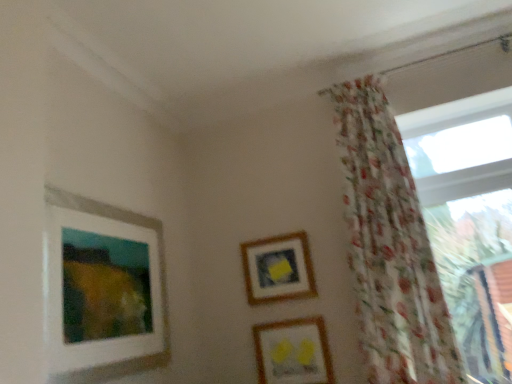
What is the approximate width of white matte picture frame at upper left, the first picture frame when ordered from left to right?

It is 2.70 inches.

How much space does matte yellow birds at lower center, which ranks as the first picture frame in right-to-left order, occupy horizontally?

It is 3.52 centimeters.

Identify the location of wooden frame at center, marked as the 2th picture frame in a left-to-right arrangement. The width and height of the screenshot is (512, 384). (278, 269).

Would you say matte yellow birds at lower center, which ranks as the first picture frame in right-to-left order, is outside transparent glass window at right?

Absolutely, matte yellow birds at lower center, which ranks as the first picture frame in right-to-left order, is external to transparent glass window at right.

Between matte yellow birds at lower center, which ranks as the first picture frame in right-to-left order, and transparent glass window at right, which one has less height?

matte yellow birds at lower center, which ranks as the first picture frame in right-to-left order.

Is matte yellow birds at lower center, which ranks as the first picture frame in right-to-left order, facing towards transparent glass window at right?

No.

From a real-world perspective, who is located lower, matte yellow birds at lower center, which ranks as the first picture frame in right-to-left order, or transparent glass window at right?

matte yellow birds at lower center, which ranks as the first picture frame in right-to-left order.

Is point (281, 367) closer or farther from the camera than point (367, 260)?

Point (281, 367) is positioned farther from the camera compared to point (367, 260).

Is matte yellow birds at lower center, arranged as the third picture frame when viewed from the left, spatially inside floral sheer curtain at right, or outside of it?

matte yellow birds at lower center, arranged as the third picture frame when viewed from the left, is outside floral sheer curtain at right.

Looking at this image, is matte yellow birds at lower center, arranged as the third picture frame when viewed from the left, with floral sheer curtain at right?

No, matte yellow birds at lower center, arranged as the third picture frame when viewed from the left, is not next to floral sheer curtain at right.

Where is `picture frame above the white matte picture frame at upper left, which is the 3th picture frame from right to left (from a real-world perspective)`? The height and width of the screenshot is (384, 512). picture frame above the white matte picture frame at upper left, which is the 3th picture frame from right to left (from a real-world perspective) is located at coordinates (278, 269).

In the scene shown: From the image's perspective, is white matte picture frame at upper left, which is the 3th picture frame from right to left, above or below wooden frame at center, marked as the 2th picture frame in a left-to-right arrangement?

white matte picture frame at upper left, which is the 3th picture frame from right to left, is situated higher than wooden frame at center, marked as the 2th picture frame in a left-to-right arrangement, in the image.

Consider the image. Is white matte picture frame at upper left, the first picture frame when ordered from left to right, wider or thinner than wooden frame at center, positioned as the second picture frame in right-to-left order?

white matte picture frame at upper left, the first picture frame when ordered from left to right, is wider than wooden frame at center, positioned as the second picture frame in right-to-left order.

Is white matte picture frame at upper left, the first picture frame when ordered from left to right, to the left or to the right of wooden frame at center, positioned as the second picture frame in right-to-left order, in the image?

Clearly, white matte picture frame at upper left, the first picture frame when ordered from left to right, is on the left of wooden frame at center, positioned as the second picture frame in right-to-left order, in the image.

Is transparent glass window at right inside or outside of floral sheer curtain at right?

transparent glass window at right is located beyond the bounds of floral sheer curtain at right.

Which of these two, transparent glass window at right or floral sheer curtain at right, is wider?

floral sheer curtain at right is wider.

Are transparent glass window at right and floral sheer curtain at right beside each other?

transparent glass window at right and floral sheer curtain at right are not in contact.

Is point (489, 286) farther from viewer compared to point (345, 216)?

No, (489, 286) is in front of (345, 216).

Considering the relative positions of transparent glass window at right and matte yellow birds at lower center, which ranks as the first picture frame in right-to-left order, in the image provided, is transparent glass window at right to the right of matte yellow birds at lower center, which ranks as the first picture frame in right-to-left order, from the viewer's perspective?

Yes, transparent glass window at right is to the right of matte yellow birds at lower center, which ranks as the first picture frame in right-to-left order.

Is transparent glass window at right surrounding matte yellow birds at lower center, arranged as the third picture frame when viewed from the left?

Definitely not — matte yellow birds at lower center, arranged as the third picture frame when viewed from the left, is not inside transparent glass window at right.

Looking at this image, is transparent glass window at right directly adjacent to matte yellow birds at lower center, arranged as the third picture frame when viewed from the left?

There is a gap between transparent glass window at right and matte yellow birds at lower center, arranged as the third picture frame when viewed from the left.

What's the angular difference between transparent glass window at right and matte yellow birds at lower center, arranged as the third picture frame when viewed from the left,'s facing directions?

The facing directions of transparent glass window at right and matte yellow birds at lower center, arranged as the third picture frame when viewed from the left, are 0.234 degrees apart.

Looking at this image, does wooden frame at center, positioned as the second picture frame in right-to-left order, have a lesser height compared to matte yellow birds at lower center, which ranks as the first picture frame in right-to-left order?

No.

Who is more distant, wooden frame at center, positioned as the second picture frame in right-to-left order, or matte yellow birds at lower center, arranged as the third picture frame when viewed from the left?

wooden frame at center, positioned as the second picture frame in right-to-left order, is behind.

From a real-world perspective, who is located lower, wooden frame at center, positioned as the second picture frame in right-to-left order, or matte yellow birds at lower center, arranged as the third picture frame when viewed from the left?

matte yellow birds at lower center, arranged as the third picture frame when viewed from the left.

Could matte yellow birds at lower center, arranged as the third picture frame when viewed from the left, be considered to be inside wooden frame at center, marked as the 2th picture frame in a left-to-right arrangement?

That's incorrect, matte yellow birds at lower center, arranged as the third picture frame when viewed from the left, is not inside wooden frame at center, marked as the 2th picture frame in a left-to-right arrangement.

Considering their positions, is matte yellow birds at lower center, which ranks as the first picture frame in right-to-left order, located in front of or behind white matte picture frame at upper left, which is the 3th picture frame from right to left?

Clearly, matte yellow birds at lower center, which ranks as the first picture frame in right-to-left order, is behind white matte picture frame at upper left, which is the 3th picture frame from right to left.

How much distance is there between matte yellow birds at lower center, which ranks as the first picture frame in right-to-left order, and white matte picture frame at upper left, the first picture frame when ordered from left to right?

matte yellow birds at lower center, which ranks as the first picture frame in right-to-left order, is 32.79 inches away from white matte picture frame at upper left, the first picture frame when ordered from left to right.

Identify the location of picture frame located underneath the white matte picture frame at upper left, which is the 3th picture frame from right to left (from a real-world perspective). (293, 352).

What are the coordinates of `window on the right of matte yellow birds at lower center, which ranks as the first picture frame in right-to-left order` in the screenshot? It's located at (467, 212).

From the image's perspective, starting from the floral sheer curtain at right, which picture frame is the 3rd one below? Please provide its 2D coordinates.

[(293, 352)]

Which object lies further to the anchor point matte yellow birds at lower center, arranged as the third picture frame when viewed from the left, floral sheer curtain at right or transparent glass window at right?

transparent glass window at right is further to matte yellow birds at lower center, arranged as the third picture frame when viewed from the left.

Considering their positions, is matte yellow birds at lower center, arranged as the third picture frame when viewed from the left, positioned closer to transparent glass window at right than floral sheer curtain at right?

floral sheer curtain at right is positioned closer to the anchor transparent glass window at right.

From the image, which object appears to be farther from wooden frame at center, marked as the 2th picture frame in a left-to-right arrangement, floral sheer curtain at right or transparent glass window at right?

transparent glass window at right is positioned further to the anchor wooden frame at center, marked as the 2th picture frame in a left-to-right arrangement.

When comparing their distances from floral sheer curtain at right, does matte yellow birds at lower center, which ranks as the first picture frame in right-to-left order, or transparent glass window at right seem further?

matte yellow birds at lower center, which ranks as the first picture frame in right-to-left order, is positioned further to the anchor floral sheer curtain at right.

Based on their spatial positions, is transparent glass window at right or matte yellow birds at lower center, arranged as the third picture frame when viewed from the left, closer to floral sheer curtain at right?

transparent glass window at right.

Which object lies further to the anchor point white matte picture frame at upper left, the first picture frame when ordered from left to right, floral sheer curtain at right or wooden frame at center, positioned as the second picture frame in right-to-left order?

floral sheer curtain at right.

Estimate the real-world distances between objects in this image. Which object is further from white matte picture frame at upper left, which is the 3th picture frame from right to left, wooden frame at center, positioned as the second picture frame in right-to-left order, or floral sheer curtain at right?

Among the two, floral sheer curtain at right is located further to white matte picture frame at upper left, which is the 3th picture frame from right to left.

Looking at the image, which one is located closer to wooden frame at center, positioned as the second picture frame in right-to-left order, matte yellow birds at lower center, arranged as the third picture frame when viewed from the left, or white matte picture frame at upper left, which is the 3th picture frame from right to left?

Among the two, matte yellow birds at lower center, arranged as the third picture frame when viewed from the left, is located nearer to wooden frame at center, positioned as the second picture frame in right-to-left order.

Image resolution: width=512 pixels, height=384 pixels. I want to click on picture frame situated between wooden frame at center, marked as the 2th picture frame in a left-to-right arrangement, and transparent glass window at right from left to right, so click(293, 352).

Locate an element on the screen. Image resolution: width=512 pixels, height=384 pixels. curtain located between matte yellow birds at lower center, arranged as the third picture frame when viewed from the left, and transparent glass window at right in the left-right direction is located at coordinates (389, 247).

Where is `curtain located between wooden frame at center, marked as the 2th picture frame in a left-to-right arrangement, and transparent glass window at right in the left-right direction`? curtain located between wooden frame at center, marked as the 2th picture frame in a left-to-right arrangement, and transparent glass window at right in the left-right direction is located at coordinates (389, 247).

This screenshot has width=512, height=384. I want to click on curtain situated between white matte picture frame at upper left, the first picture frame when ordered from left to right, and transparent glass window at right from left to right, so click(389, 247).